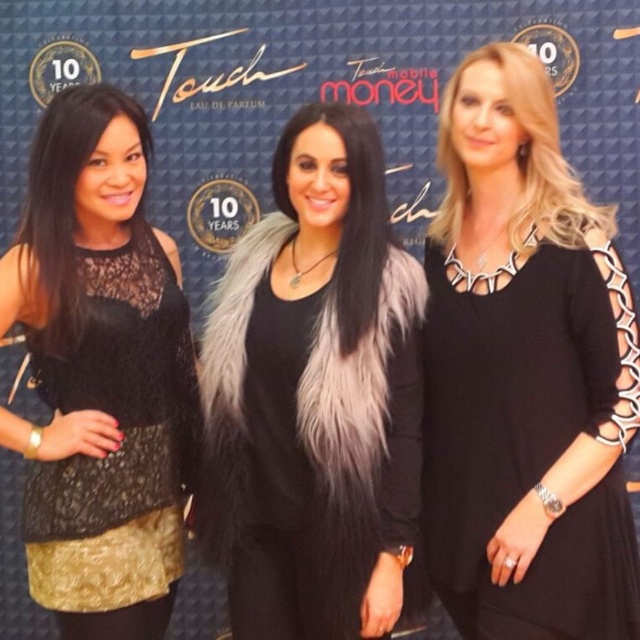
You are a photographer standing in front of the backdrop. You want to take a photo that focuses on the black lace top at left and the black matte dress at center. Which one will appear larger in the photo?

The black matte dress at center will appear larger in the photo because it is closer to the viewer than the black lace top at left.

You are a photographer at the event and need to position a spotlight exactly at the center of the black matte dress at center. According to the coordinates provided, where should you aim the spotlight?

The spotlight should be aimed at the coordinates point (525, 372) where the black matte dress at center is located.